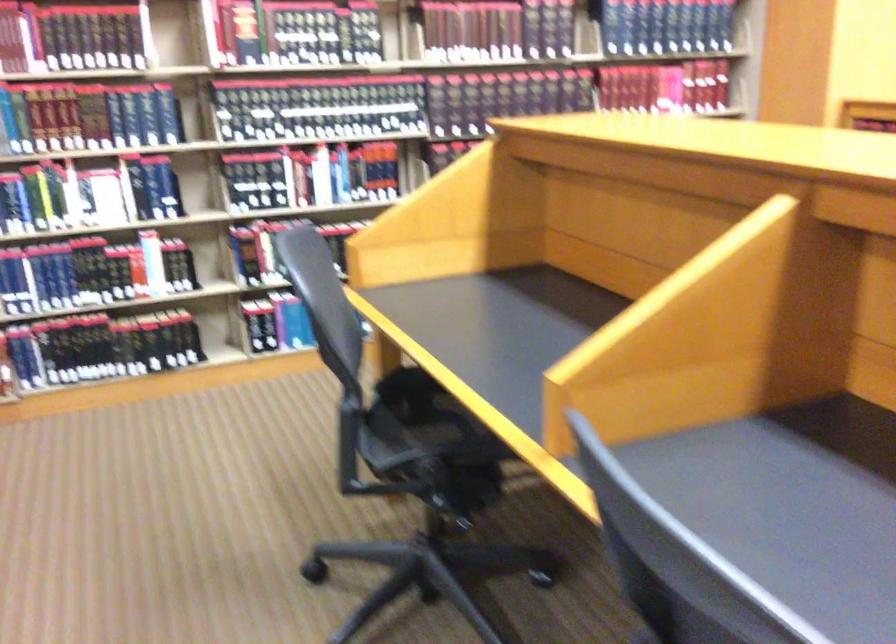
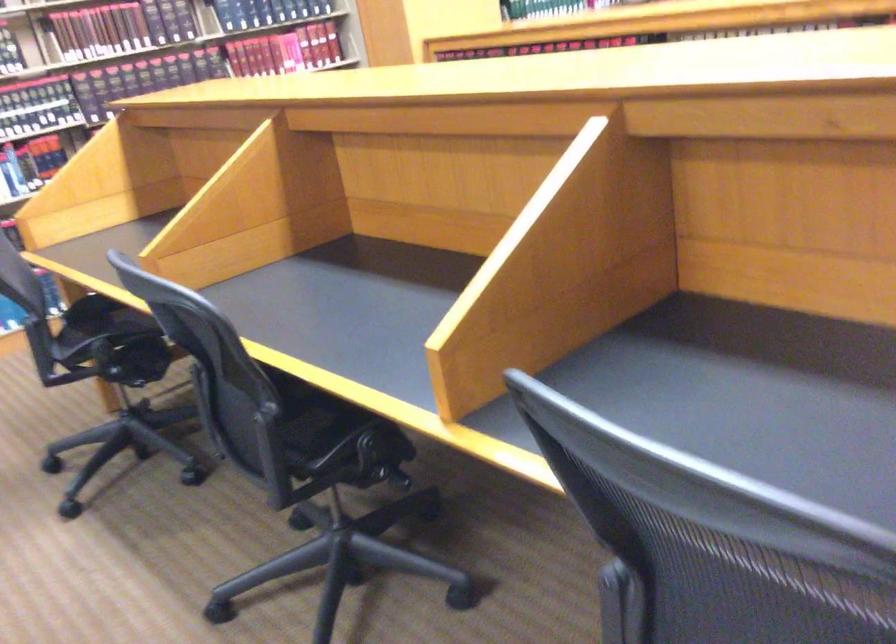
The point at (458, 108) is marked in the first image. Where is the corresponding point in the second image?

(99, 89)